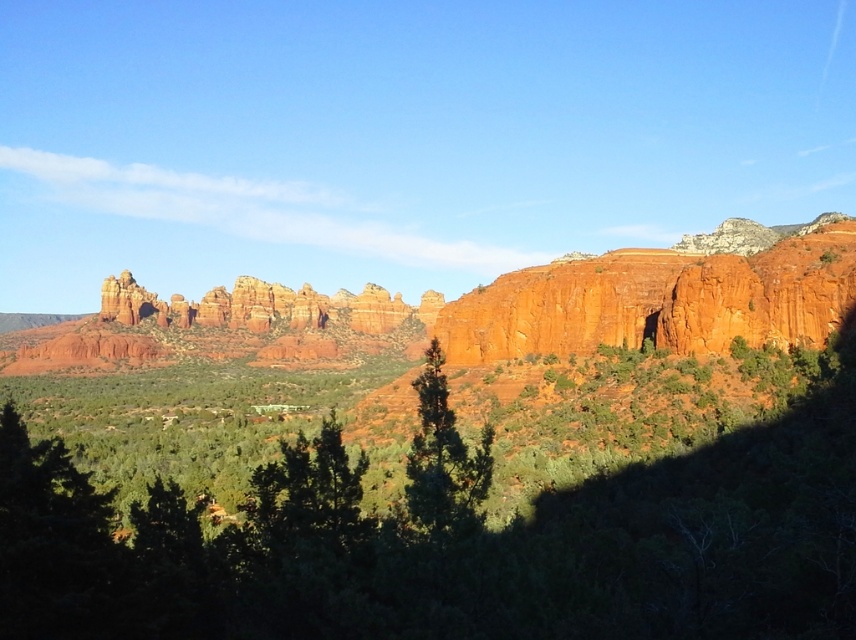
Question: Which of these objects is positioned farthest from the green leafy tree at center?

Choices:
 (A) reddish-brown rock formation at center
 (B) rustic sandstone rock formation at center

Answer: (B)

Question: Can you confirm if green leafy tree at center is smaller than reddish-brown rock formation at center?

Choices:
 (A) no
 (B) yes

Answer: (B)

Question: Considering the relative positions of rustic sandstone rock formation at center and green matte tree at center in the image provided, where is rustic sandstone rock formation at center located with respect to green matte tree at center?

Choices:
 (A) left
 (B) right

Answer: (A)

Question: Which of the following is the farthest from the observer?

Choices:
 (A) (431, 340)
 (B) (278, 548)
 (C) (749, 330)
 (D) (282, 300)

Answer: (D)

Question: Which point appears closest to the camera in this image?

Choices:
 (A) (450, 451)
 (B) (278, 292)

Answer: (A)

Question: Can you confirm if green leafy tree at center is wider than green matte tree at center?

Choices:
 (A) no
 (B) yes

Answer: (B)